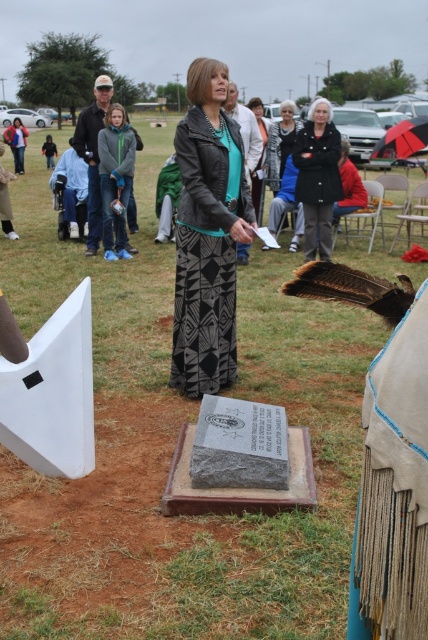
Question: Considering the relative positions of matte black leather jacket at center and black textured coat at center in the image provided, where is matte black leather jacket at center located with respect to black textured coat at center?

Choices:
 (A) left
 (B) right

Answer: (A)

Question: Is matte black leather jacket at center above matte black jacket at center?

Choices:
 (A) no
 (B) yes

Answer: (A)

Question: Does matte black leather jacket at center have a lesser width compared to black textured coat at center?

Choices:
 (A) no
 (B) yes

Answer: (A)

Question: Which point is closer to the camera taking this photo?

Choices:
 (A) (317, 193)
 (B) (181, 148)

Answer: (B)

Question: Which of these objects is positioned closest to the black textured coat at center?

Choices:
 (A) matte black leather jacket at center
 (B) matte black jacket at center

Answer: (B)

Question: Which point is closer to the camera?

Choices:
 (A) matte black jacket at center
 (B) matte black leather jacket at center
 (C) black textured coat at center

Answer: (B)